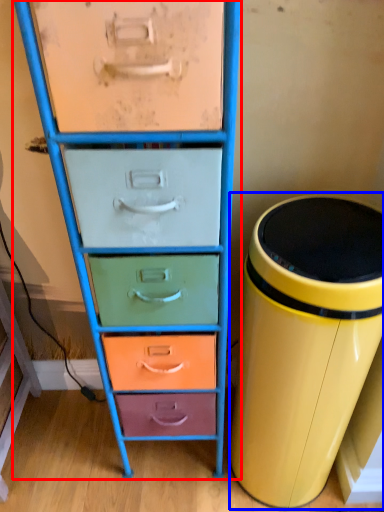
Question: Which point is further to the camera, chest of drawers (highlighted by a red box) or waste container (highlighted by a blue box)?

Choices:
 (A) chest of drawers
 (B) waste container

Answer: (B)